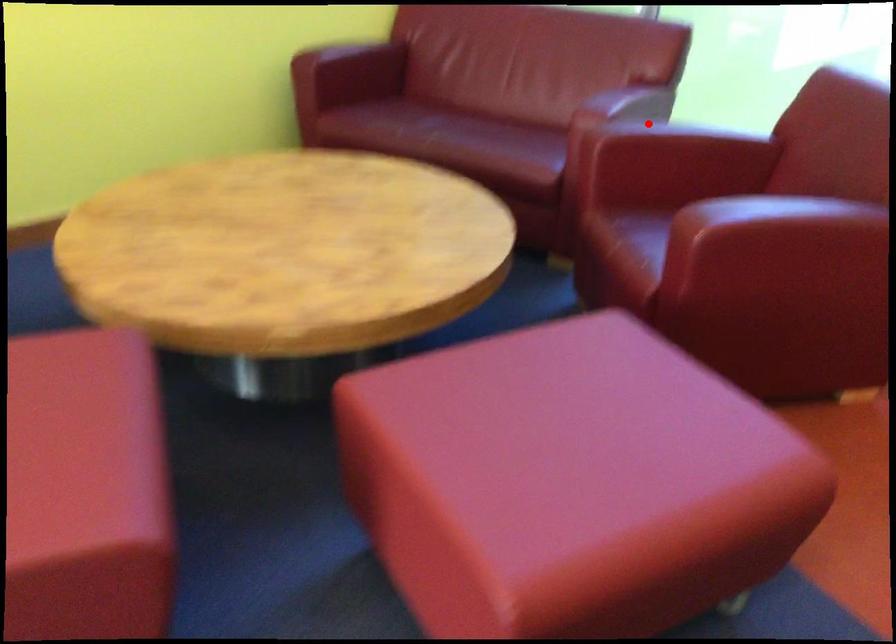
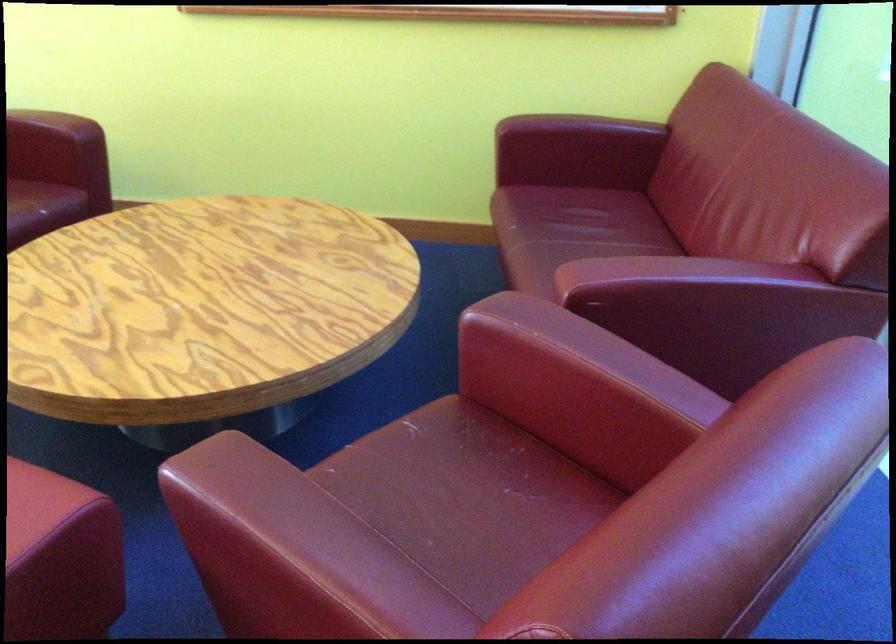
Question: A red point is marked in image1. In image2, is the corresponding 3D point closer to the camera or farther? Reply with the corresponding letter.

Choices:
 (A) The corresponding 3D point is closer.
 (B) The corresponding 3D point is farther.

Answer: (A)